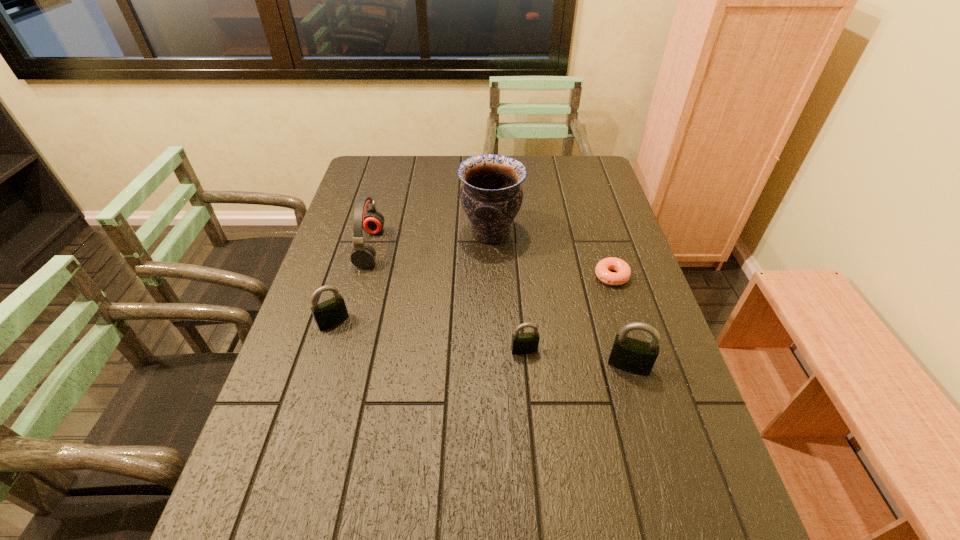
Identify the location of the farthest padlock. The width and height of the screenshot is (960, 540). (333, 311).

This screenshot has height=540, width=960. Identify the location of the leftmost padlock. (333, 311).

Locate an element on the screen. The height and width of the screenshot is (540, 960). the second farthest padlock is located at coordinates (522, 343).

I want to click on the fifth farthest object, so (522, 343).

Identify the location of the rightmost padlock. (628, 354).

In order to click on the tallest padlock in this screenshot , I will do `click(628, 354)`.

At what (x,y) coordinates should I click in order to perform the action: click on doughnut. Please return your answer as a coordinate pair (x, y). Image resolution: width=960 pixels, height=540 pixels. Looking at the image, I should click on (622, 268).

Locate an element on the screen. The height and width of the screenshot is (540, 960). pottery is located at coordinates (491, 196).

Identify the location of earphone. This screenshot has height=540, width=960. (363, 255).

Locate an element on the screen. vacant space located on the right of the third shortest object is located at coordinates (395, 321).